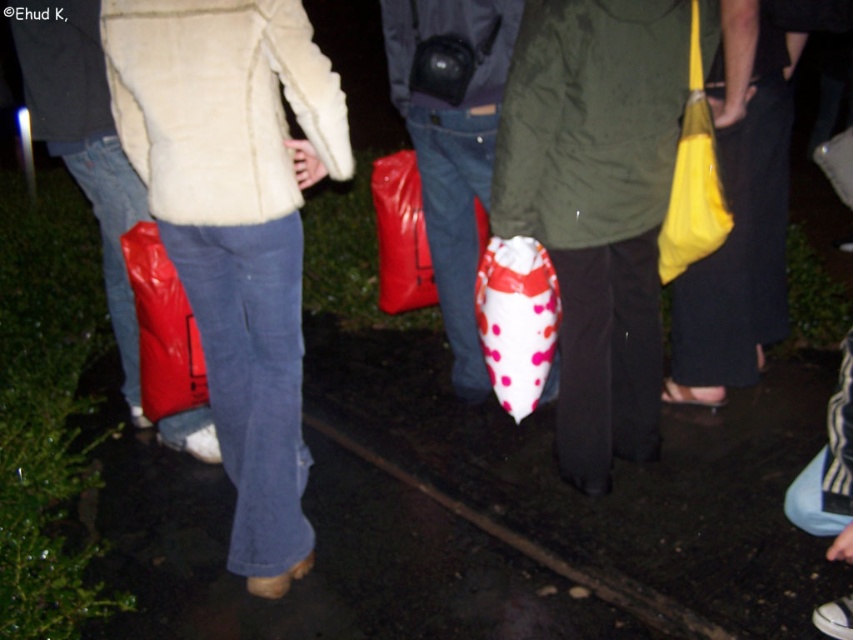
Question: Among these points, which one is nearest to the camera?

Choices:
 (A) (276, 29)
 (B) (457, 230)
 (C) (698, 51)
 (D) (386, 176)

Answer: (A)

Question: Which point is farther from the camera taking this photo?

Choices:
 (A) (450, 244)
 (B) (695, 195)

Answer: (A)

Question: Can you confirm if matte white jacket at center is positioned above white dotted plastic bag at center?

Choices:
 (A) yes
 (B) no

Answer: (A)

Question: Is matte blue jeans at left bigger than yellow fabric bag at right?

Choices:
 (A) yes
 (B) no

Answer: (A)

Question: Where is white dotted plastic bag at center located in relation to yellow fabric bag at right in the image?

Choices:
 (A) left
 (B) right

Answer: (A)

Question: Which of the following is the farthest from the observer?

Choices:
 (A) click(x=239, y=525)
 (B) click(x=171, y=275)
 (C) click(x=492, y=40)
 (D) click(x=490, y=262)

Answer: (C)